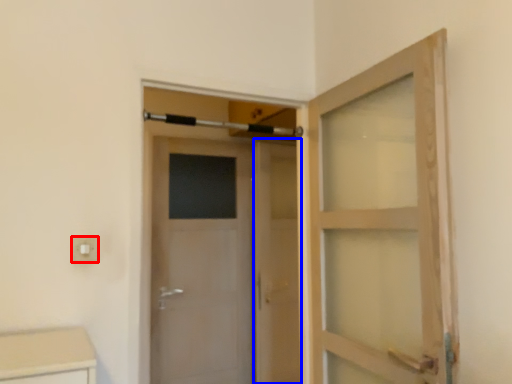
Question: Which object appears farthest to the camera in this image, electric outlet (highlighted by a red box) or screen door (highlighted by a blue box)?

Choices:
 (A) electric outlet
 (B) screen door

Answer: (B)